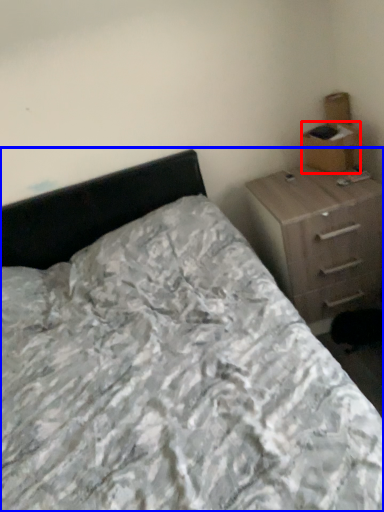
Question: Which object appears closest to the camera in this image, cardboard box (highlighted by a red box) or bed (highlighted by a blue box)?

Choices:
 (A) cardboard box
 (B) bed

Answer: (B)